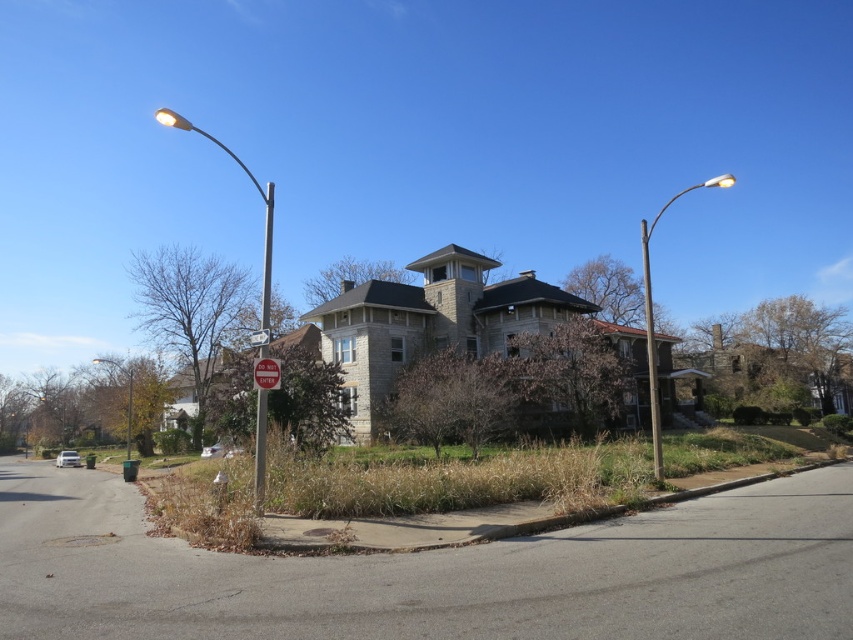
Question: Which point is closer to the camera?

Choices:
 (A) metallic pole at lower left
 (B) white metal pole at left
 (C) metallic silver streetlight at right
 (D) white plastic sign at center

Answer: (B)

Question: Does white metal pole at left lie in front of white plastic sign at center?

Choices:
 (A) yes
 (B) no

Answer: (A)

Question: Does white metal pole at left appear on the left side of red painted metal sign at center?

Choices:
 (A) yes
 (B) no

Answer: (A)

Question: Which of these objects is positioned closest to the red painted metal sign at center?

Choices:
 (A) metallic pole at right
 (B) metallic pole at lower left
 (C) metallic pole at left
 (D) white plastic sign at center

Answer: (D)

Question: Which point is farther to the camera?

Choices:
 (A) (247, 176)
 (B) (265, 337)
 (C) (654, 461)
 (D) (647, 250)

Answer: (A)

Question: Is the position of white metal pole at left more distant than that of metallic pole at lower left?

Choices:
 (A) yes
 (B) no

Answer: (B)